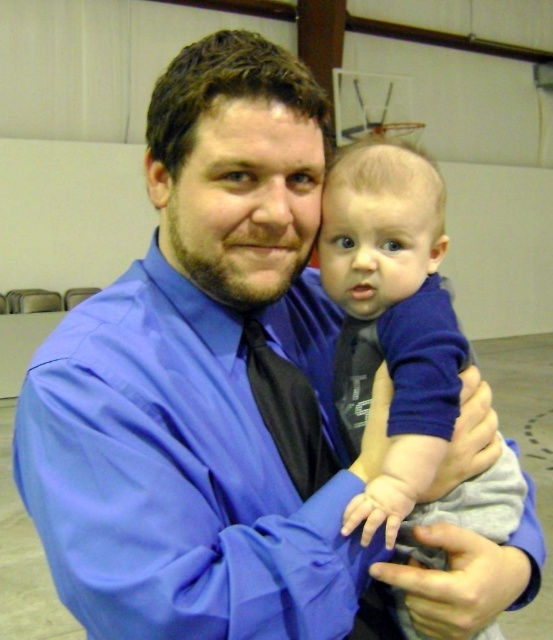
You are a photographer setting up for a family photo. You need to ensure that the blue soft baby at center is positioned so that it is taller than the black satin tie at center. Based on the scene description, is this requirement already met?

Yes, the blue soft baby at center is already taller than the black satin tie at center according to the description.

You are a photographer trying to capture a closeup of the black satin tie at center without the blue soft baby at center blocking it. What should you do?

The blue soft baby at center is in front of the black satin tie at center, so you should move the blue soft baby at center out of the way or adjust your angle to avoid the baby blocking the view of the black satin tie at center.

You are standing in the gymnas and want to place a small decoration between the two points, point (326, 188) and point (321, 464). Which point should the decoration be closer to in order to appear centered from your viewing position?

The decoration should be closer to point (326, 188) because it is closer to the viewer than point (321, 464), so placing it nearer to that point will make it appear centered from your perspective.